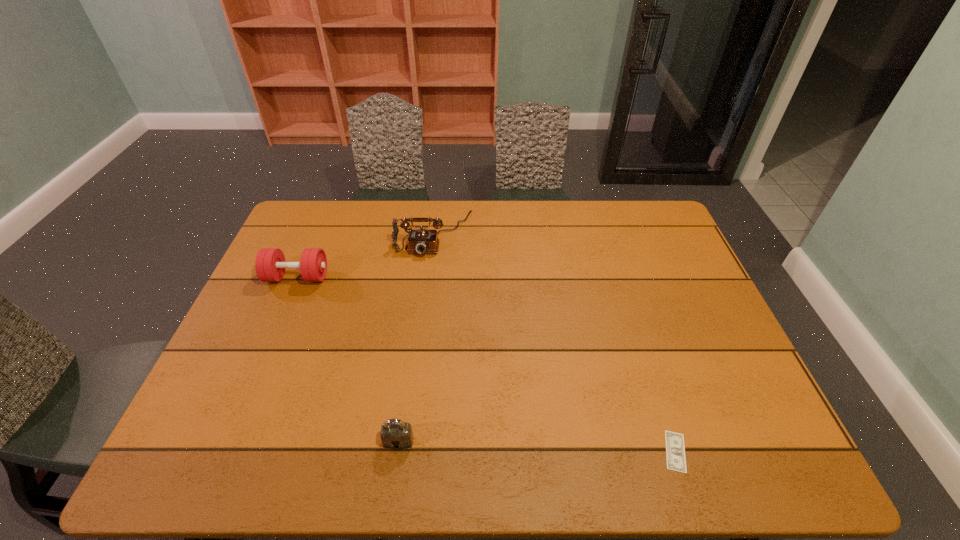
Locate an element on the screen. free area in between the shortest object and the padlock is located at coordinates (537, 446).

In order to click on vacant space that's between the leftmost object and the padlock in this screenshot , I will do `click(348, 359)`.

Locate an element on the screen. unoccupied area between the money and the padlock is located at coordinates (537, 446).

Image resolution: width=960 pixels, height=540 pixels. Find the location of `unoccupied position between the second farthest object and the padlock`. unoccupied position between the second farthest object and the padlock is located at coordinates (348, 359).

Where is `empty space between the farthest object and the padlock`? The height and width of the screenshot is (540, 960). empty space between the farthest object and the padlock is located at coordinates [x=416, y=338].

Image resolution: width=960 pixels, height=540 pixels. I want to click on free space between the dumbbell and the money, so click(x=487, y=364).

At what (x,y) coordinates should I click in order to perform the action: click on free spot between the telephone and the padlock. Please return your answer as a coordinate pair (x, y). Looking at the image, I should click on (416, 338).

At what (x,y) coordinates should I click in order to perform the action: click on vacant space that's between the second farthest object and the telephone. Please return your answer as a coordinate pair (x, y). Looking at the image, I should click on (366, 255).

You are a GUI agent. You are given a task and a screenshot of the screen. Output one action in this format:
    pyautogui.click(x=<x>, y=<y>)
    Task: Click on the unoccupied area between the second farthest object and the padlock
    Image resolution: width=960 pixels, height=540 pixels.
    Given the screenshot: What is the action you would take?
    pyautogui.click(x=348, y=359)

Where is `unoccupied area between the rightmost object and the padlock`? The image size is (960, 540). unoccupied area between the rightmost object and the padlock is located at coordinates tap(537, 446).